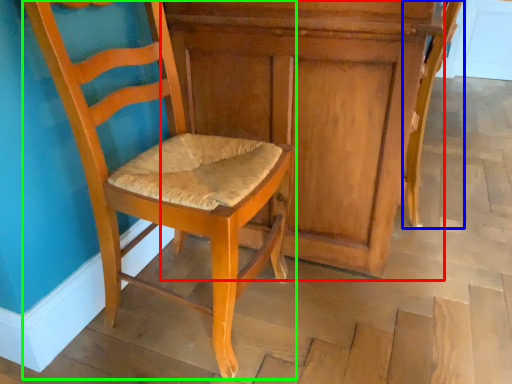
Question: Which object is the farthest from dresser (highlighted by a red box)? Choose among these: chair (highlighted by a blue box) or chair (highlighted by a green box).

Choices:
 (A) chair
 (B) chair

Answer: (A)